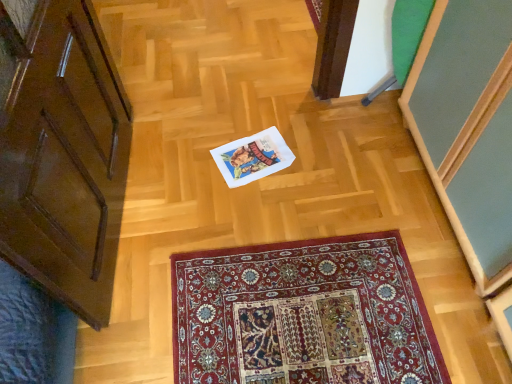
What do you see at coordinates (64, 157) in the screenshot? Image resolution: width=512 pixels, height=384 pixels. I see `shiny dark wood cabinet at left` at bounding box center [64, 157].

Identify the location of shiny dark wood cabinet at left. The width and height of the screenshot is (512, 384). (64, 157).

Locate an element on the screen. The width and height of the screenshot is (512, 384). shiny dark wood cabinet at left is located at coordinates (64, 157).